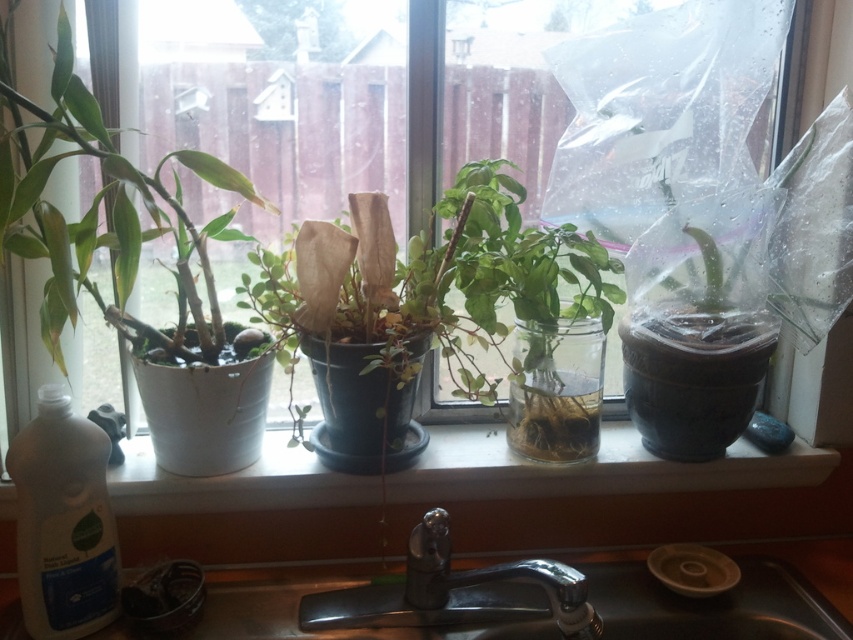
Question: Does green matte plant at center lie behind white glossy window sill at center?

Choices:
 (A) no
 (B) yes

Answer: (A)

Question: Which object is farther from the camera taking this photo?

Choices:
 (A) green matte plant at center
 (B) metallic sink at lower center

Answer: (A)

Question: Among these points, which one is nearest to the camera?

Choices:
 (A) (299, 593)
 (B) (483, 428)

Answer: (A)

Question: Does white glossy window sill at center appear over metallic sink at lower center?

Choices:
 (A) no
 (B) yes

Answer: (B)

Question: Does white glossy window sill at center come behind metallic sink at lower center?

Choices:
 (A) yes
 (B) no

Answer: (A)

Question: Which point is closer to the camera?

Choices:
 (A) metallic sink at lower center
 (B) green matte plant at center

Answer: (A)